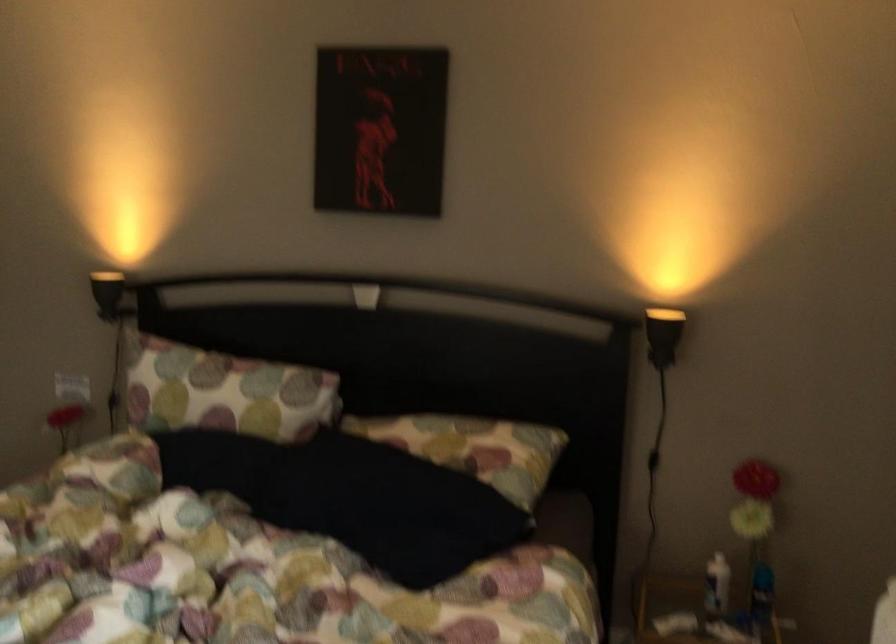
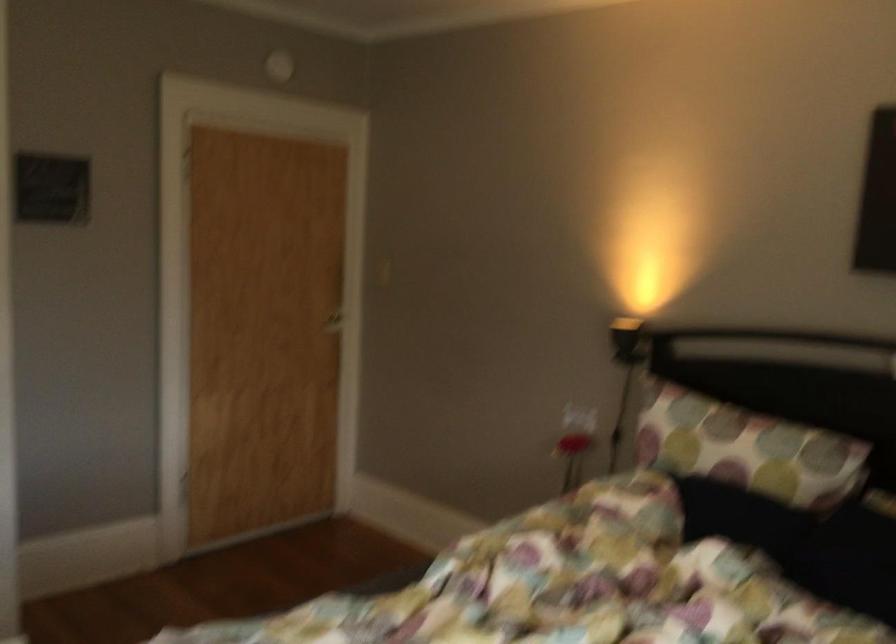
Question: The images are taken continuously from a first-person perspective. In which direction is your viewpoint rotating?

Choices:
 (A) Left
 (B) Right
 (C) Up
 (D) Down

Answer: (A)